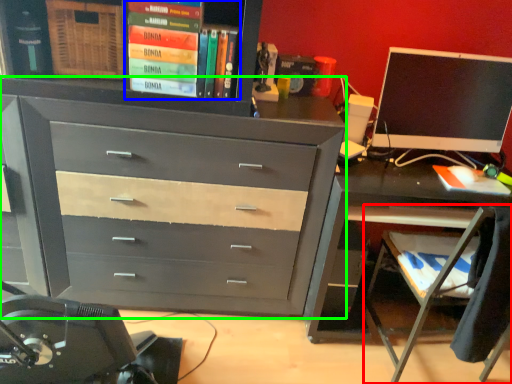
Question: Based on their relative distances, which object is nearer to computer chair (highlighted by a red box)? Choose from book (highlighted by a blue box) and chest of drawers (highlighted by a green box).

Choices:
 (A) book
 (B) chest of drawers

Answer: (B)